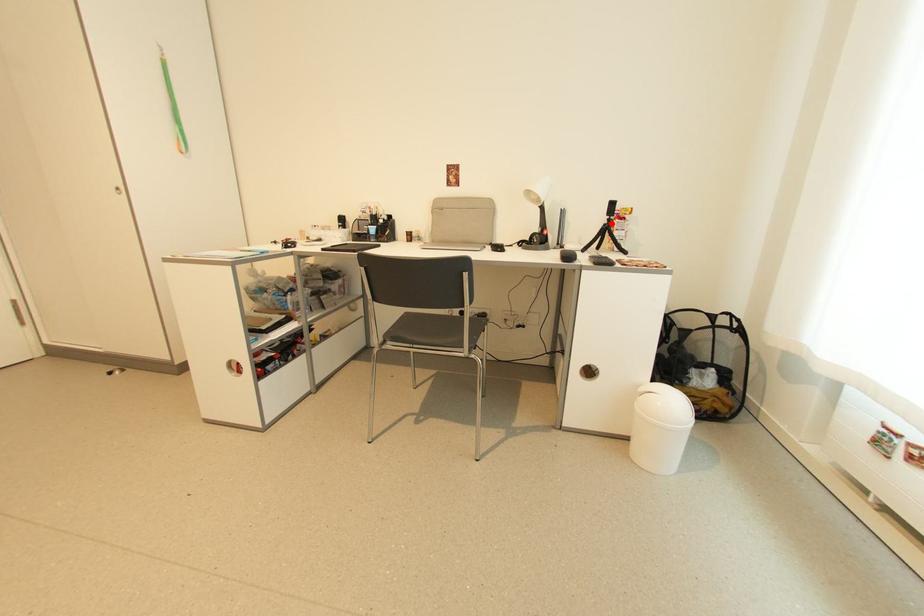
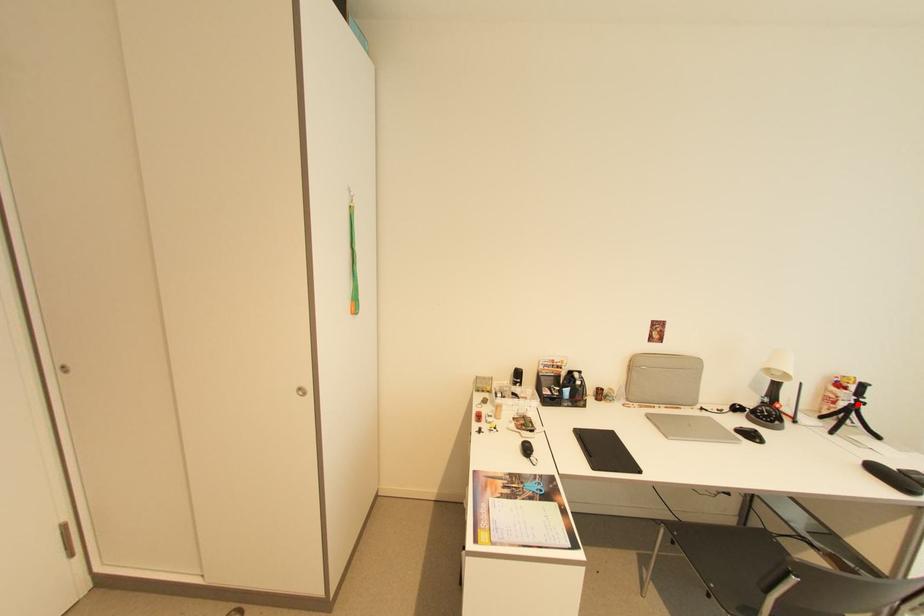
I am providing you with two images of the same scene from different viewpoints. A red point is marked on the first image and another point is marked on the second image. Does the point marked in image1 correspond to the same location as the one in image2?

Yes